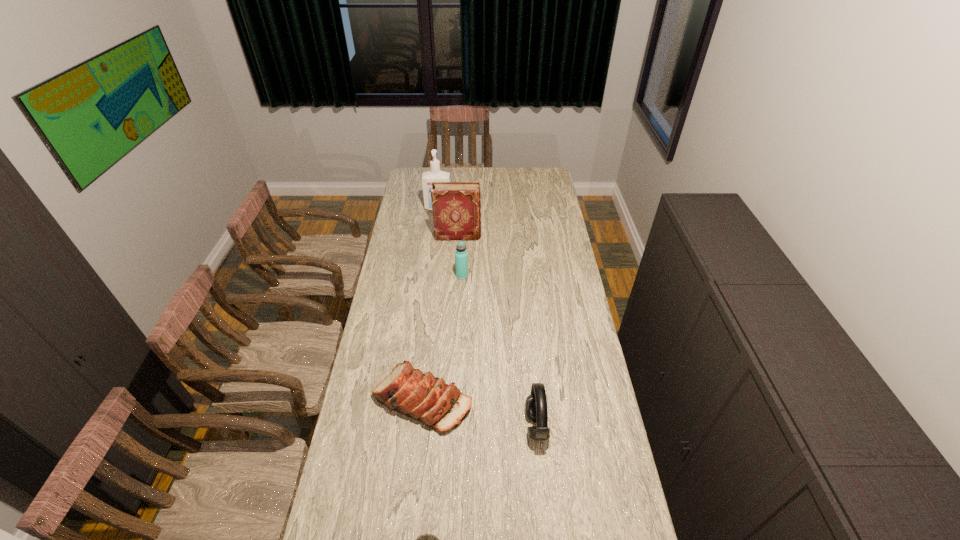
You are a GUI agent. You are given a task and a screenshot of the screen. Output one action in this format:
    pyautogui.click(x=<x>, y=<y>)
    Task: Click on the cleansing agent
    
    Given the screenshot: What is the action you would take?
    pyautogui.click(x=435, y=175)

Where is `the second tallest object`? Image resolution: width=960 pixels, height=540 pixels. the second tallest object is located at coordinates (456, 206).

The height and width of the screenshot is (540, 960). Find the location of `hardback book`. hardback book is located at coordinates (456, 206).

Where is `thermos bottle`? This screenshot has width=960, height=540. thermos bottle is located at coordinates (461, 262).

You are a GUI agent. You are given a task and a screenshot of the screen. Output one action in this format:
    pyautogui.click(x=<x>, y=<y>)
    Task: Click on the rightmost object
    This screenshot has height=540, width=960.
    Given the screenshot: What is the action you would take?
    pyautogui.click(x=536, y=403)

Locate an element on the screen. Image resolution: width=960 pixels, height=540 pixels. bread is located at coordinates (428, 399).

Find the location of a particular element. This screenshot has width=960, height=540. vacant space located on the front label of the farthest object is located at coordinates (436, 228).

The height and width of the screenshot is (540, 960). I want to click on vacant region located on the spine side of the hardback book, so pos(512,236).

At what (x,y) coordinates should I click in order to perform the action: click on free space located on the front of the fourth nearest object. Please return your answer as a coordinate pair (x, y). Looking at the image, I should click on (460, 316).

The width and height of the screenshot is (960, 540). I want to click on free spot located on the earcups of the headset, so click(476, 427).